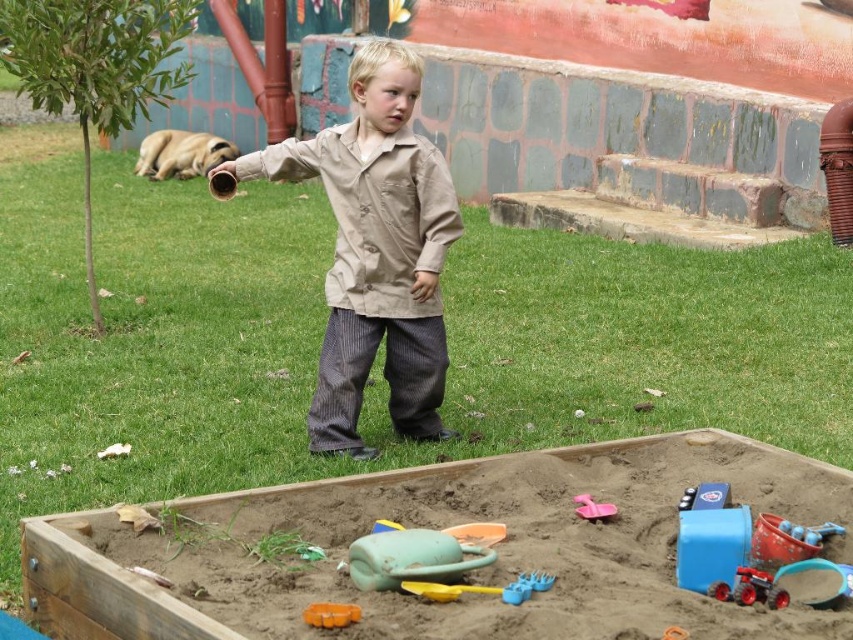
Question: Is tan fabric shirt at center to the right of green rubber shovel at lower center from the viewer's perspective?

Choices:
 (A) yes
 (B) no

Answer: (B)

Question: Which of the following is the closest to the observer?

Choices:
 (A) (589, 500)
 (B) (709, 595)
 (C) (354, 608)

Answer: (C)

Question: Does brown sandy sandbox at lower center have a greater width compared to orange rubber toy at lower center?

Choices:
 (A) no
 (B) yes

Answer: (B)

Question: Which object appears closest to the camera in this image?

Choices:
 (A) tan fabric trench coat at center
 (B) blue plastic toy at lower right
 (C) orange rubber toy at lower center
 (D) pink plastic shovel at lower center

Answer: (C)

Question: Is brown sandy sandbox at lower center smaller than pink plastic shovel at lower center?

Choices:
 (A) yes
 (B) no

Answer: (B)

Question: Among these objects, which one is nearest to the camera?

Choices:
 (A) tan fabric trench coat at center
 (B) brown sandy sandbox at lower center
 (C) pink plastic shovel at lower center

Answer: (B)